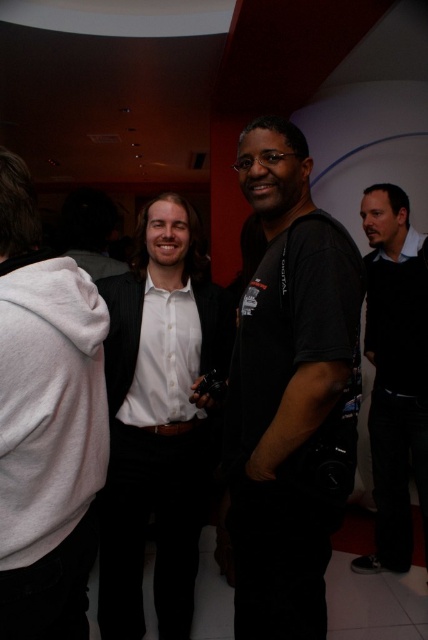
Question: Is black cotton t-shirt at center positioned in front of white glossy shirt at center?

Choices:
 (A) no
 (B) yes

Answer: (B)

Question: Does black cotton t-shirt at center have a larger size compared to black matte shirt at right?

Choices:
 (A) no
 (B) yes

Answer: (A)

Question: Which object is the farthest from the white glossy shirt at center?

Choices:
 (A) white fleece sweatshirt at left
 (B) black cotton t-shirt at center

Answer: (A)

Question: Is black cotton t-shirt at center further to the viewer compared to white fleece sweatshirt at left?

Choices:
 (A) yes
 (B) no

Answer: (A)

Question: Estimate the real-world distances between objects in this image. Which object is closer to the black matte shirt at right?

Choices:
 (A) white glossy shirt at center
 (B) black cotton t-shirt at center
 (C) white fleece sweatshirt at left

Answer: (A)

Question: Which point appears farthest from the camera in this image?

Choices:
 (A) (70, 627)
 (B) (272, 624)
 (C) (121, 371)
 (D) (382, 524)

Answer: (D)